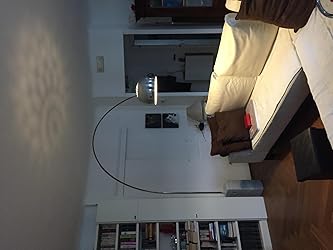
Find the location of a particular element. This screenshot has width=333, height=250. pillows is located at coordinates (228, 121).